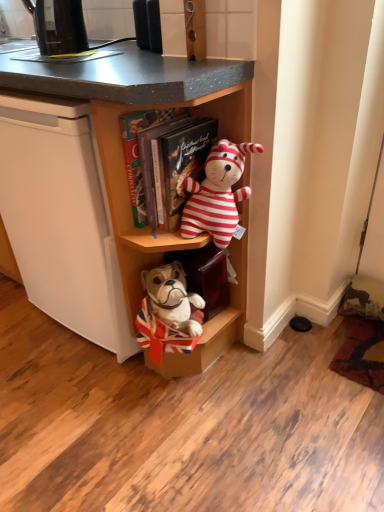
At what (x,y) coordinates should I click in order to perform the action: click on free region on the left part of black plastic kettle at upper left. Please return your answer as a coordinate pair (x, y). The image size is (384, 512). Looking at the image, I should click on (20, 52).